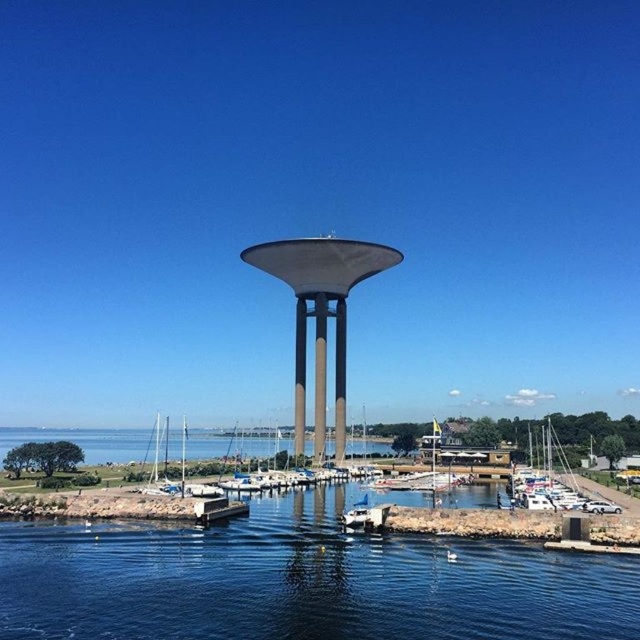
Question: Which of these objects is positioned farthest from the sleek metallic tower at center?

Choices:
 (A) brown concrete pillar at center
 (B) blue water at center
 (C) matte gray pillar at center

Answer: (B)

Question: Does white matte sailboat at lower right have a larger size compared to matte gray pillar at center?

Choices:
 (A) no
 (B) yes

Answer: (B)

Question: Which point is farther to the camera?

Choices:
 (A) brown concrete pillar at center
 (B) matte gray pillar at center
 (C) sleek metallic tower at center

Answer: (A)

Question: Considering the relative positions of white matte sailboat at lower right and brown concrete pillar at center in the image provided, where is white matte sailboat at lower right located with respect to brown concrete pillar at center?

Choices:
 (A) left
 (B) right

Answer: (B)

Question: Does blue water at center appear on the left side of sleek metallic tower at center?

Choices:
 (A) yes
 (B) no

Answer: (A)

Question: Which of these objects is positioned closest to the smooth concrete observation tower at center?

Choices:
 (A) matte gray pillar at center
 (B) brown concrete pillar at center
 (C) blue water at center

Answer: (B)